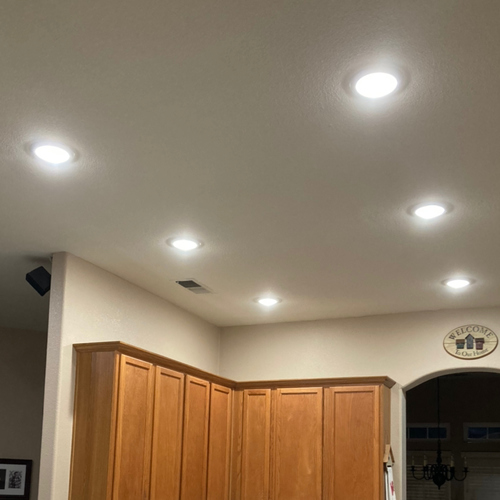
At what (x,y) coordinates should I click in order to perform the action: click on recessed lighting. Please return your answer as a coordinate pair (x, y). The width and height of the screenshot is (500, 500). Looking at the image, I should click on (52, 155), (188, 246), (269, 304), (454, 283), (430, 213), (375, 88).